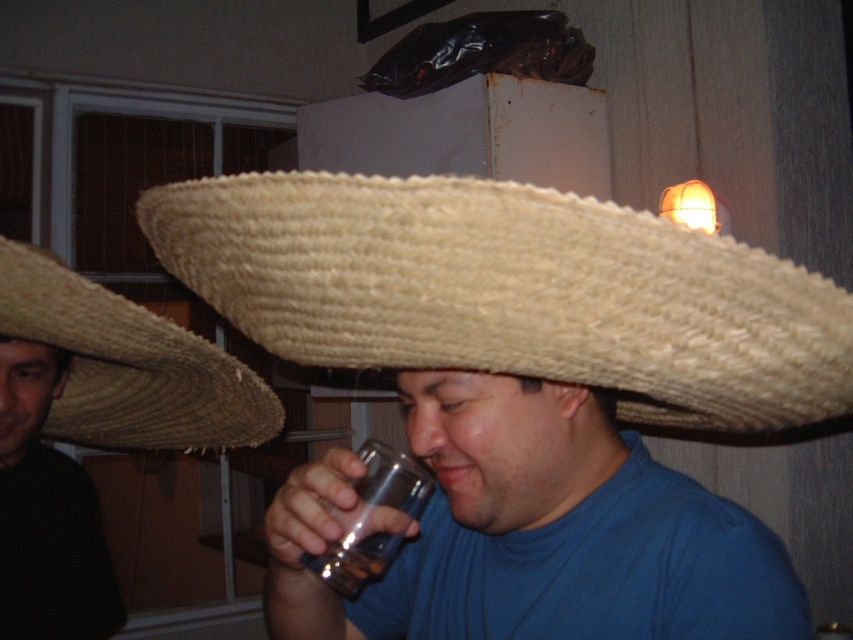
You are a bartender preparing a drink. You have a natural straw sombrero at center and a transparent glass at lower center in front of you. Which object is closer to the ceiling?

The natural straw sombrero at center is above the transparent glass at lower center, so it is closer to the ceiling.

You are a bartender preparing a drink. You have a natural straw sombrero at center and a transparent glass at lower center in front of you. Which object is bigger?

The natural straw sombrero at center is larger in size compared to the transparent glass at lower center.

You are standing in a room with a window and a refrigerator. You need to place a new poster on the wall where the woven straw sombrero at upper left is currently located. According to the coordinates provided, where exactly should you place the poster?

The woven straw sombrero at upper left is located at point (129, 365), so you should place the poster at those coordinates on the wall.